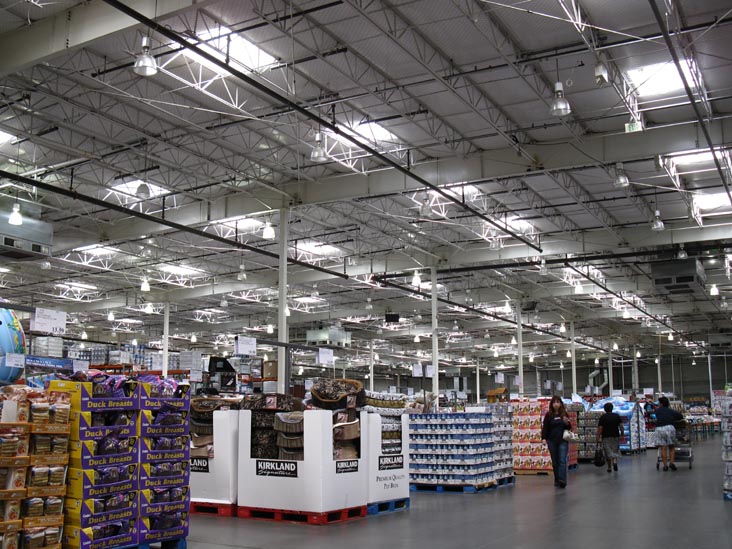
Identify the location of ceiling. tap(375, 125).